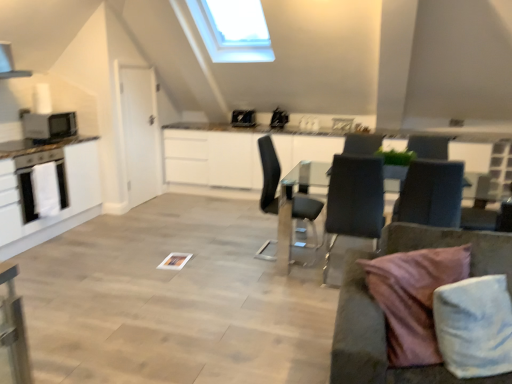
Measure the distance between white glossy cabinetry at left and camera.

white glossy cabinetry at left is 3.52 meters from camera.

Describe the element at coordinates (56, 194) in the screenshot. I see `white glossy cabinetry at left` at that location.

From the picture: What is the approximate height of pink fabric pillow at lower right?

pink fabric pillow at lower right is 18.62 inches in height.

What are the coordinates of `white glossy exhaust hood at upper left` in the screenshot? It's located at (9, 63).

The image size is (512, 384). Find the location of `velvet grey couch at lower right`. velvet grey couch at lower right is located at coordinates (384, 315).

Locate an element on the screen. The height and width of the screenshot is (384, 512). white glossy cabinetry at left is located at coordinates (56, 194).

Between glossy white counter at center and black leather chair at center, the 2th chair when ordered from left to right, which one has larger size?

With larger size is glossy white counter at center.

Which of these two, glossy white counter at center or black leather chair at center, placed as the 2th chair when sorted from right to left, is thinner?

black leather chair at center, placed as the 2th chair when sorted from right to left.

From the image's perspective, count 3rd chairs downward from the glossy white counter at center and point to it. Please provide its 2D coordinates.

[(354, 201)]

Considering the relative sizes of satin black toaster at upper center, the first appliance viewed from the back, and transparent glass table at center in the image provided, is satin black toaster at upper center, the first appliance viewed from the back, bigger than transparent glass table at center?

Actually, satin black toaster at upper center, the first appliance viewed from the back, might be smaller than transparent glass table at center.

Considering the points (253, 125) and (286, 184), which point is in front, point (253, 125) or point (286, 184)?

The point (286, 184) is closer to the camera.

Considering the relative sizes of satin black toaster at upper center, which appears as the third appliance when viewed from the front, and transparent glass table at center in the image provided, is satin black toaster at upper center, which appears as the third appliance when viewed from the front, wider than transparent glass table at center?

No.

From their relative heights in the image, would you say dark gray fabric chair at center, the 3th chair positioned from the left, is taller or shorter than white glossy cabinetry at left?

In the image, dark gray fabric chair at center, the 3th chair positioned from the left, appears to be shorter than white glossy cabinetry at left.

How many degrees apart are the facing directions of dark gray fabric chair at center, the 3th chair positioned from the left, and white glossy cabinetry at left?

There is a 88.7-degree angle between the facing directions of dark gray fabric chair at center, the 3th chair positioned from the left, and white glossy cabinetry at left.

Does dark gray fabric chair at center, the 1th chair in the right-to-left sequence, have a greater width compared to white glossy cabinetry at left?

No.

From the image's perspective, which is above, dark gray fabric chair at center, the 3th chair positioned from the left, or white glossy cabinetry at left?

white glossy cabinetry at left is shown above in the image.

From the image's perspective, is matte black microwave at left, the 3th appliance when ordered from right to left, beneath black leather chair at center, placed as the 2th chair when sorted from right to left?

No.

Considering the sizes of objects matte black microwave at left, the 3th appliance when ordered from right to left, and black leather chair at center, placed as the 2th chair when sorted from right to left, in the image provided, who is shorter, matte black microwave at left, the 3th appliance when ordered from right to left, or black leather chair at center, placed as the 2th chair when sorted from right to left,?

matte black microwave at left, the 3th appliance when ordered from right to left.

Considering the sizes of matte black microwave at left, the first appliance from the front, and black leather chair at center, placed as the 2th chair when sorted from right to left, in the image, is matte black microwave at left, the first appliance from the front, wider or thinner than black leather chair at center, placed as the 2th chair when sorted from right to left,?

Clearly, matte black microwave at left, the first appliance from the front, has less width compared to black leather chair at center, placed as the 2th chair when sorted from right to left.

From a real-world perspective, is matte black microwave at left, the first appliance from the front, positioned above or below black leather chair at center, placed as the 2th chair when sorted from right to left?

Result: matte black microwave at left, the first appliance from the front, is above black leather chair at center, placed as the 2th chair when sorted from right to left.

Consider the image. Between glossy white counter at center and satin black toaster at upper center, the first appliance viewed from the back, which one appears on the left side from the viewer's perspective?

satin black toaster at upper center, the first appliance viewed from the back.

Is glossy white counter at center bigger than satin black toaster at upper center, placed as the 2th appliance when sorted from left to right?

Indeed, glossy white counter at center has a larger size compared to satin black toaster at upper center, placed as the 2th appliance when sorted from left to right.

Does glossy white counter at center turn towards satin black toaster at upper center, the first appliance viewed from the back?

No, glossy white counter at center is not facing towards satin black toaster at upper center, the first appliance viewed from the back.

Is satin black laptop at upper center, which is the first appliance in right-to-left order, in front of transparent glass table at center?

No, the depth of satin black laptop at upper center, which is the first appliance in right-to-left order, is greater than that of transparent glass table at center.

Considering the positions of objects satin black laptop at upper center, which ranks as the second appliance in back-to-front order, and transparent glass table at center in the image provided, who is more to the right, satin black laptop at upper center, which ranks as the second appliance in back-to-front order, or transparent glass table at center?

Positioned to the right is transparent glass table at center.

Does satin black laptop at upper center, which appears as the 2th appliance when viewed from the front, have a smaller size compared to transparent glass table at center?

Correct, satin black laptop at upper center, which appears as the 2th appliance when viewed from the front, occupies less space than transparent glass table at center.

Who is bigger, matte black microwave at left, the 3th appliance when ordered from right to left, or glossy white counter at center?

glossy white counter at center is bigger.

Between matte black microwave at left, positioned as the 1th appliance in left-to-right order, and glossy white counter at center, which one has less height?

With less height is matte black microwave at left, positioned as the 1th appliance in left-to-right order.

From the image's perspective, is matte black microwave at left, positioned as the 1th appliance in left-to-right order, on top of glossy white counter at center?

Yes, from the image's perspective, matte black microwave at left, positioned as the 1th appliance in left-to-right order, is over glossy white counter at center.

Does point (31, 129) come in front of point (332, 156)?

Yes, it is.

Identify the location of the 2nd chair in front of the glossy white counter at center. The image size is (512, 384). (354, 201).

Starting from the transparent glass table at center, which appliance is the 3rd one behind? Please provide its 2D coordinates.

[(243, 118)]

When comparing their distances from satin black laptop at upper center, which is the first appliance in right-to-left order, does pink fabric pillow at lower right or dark gray fabric chair at center, the 1th chair in the right-to-left sequence, seem closer?

dark gray fabric chair at center, the 1th chair in the right-to-left sequence, lies closer to satin black laptop at upper center, which is the first appliance in right-to-left order, than the other object.

Which object lies further to the anchor point white glossy exhaust hood at upper left, white glossy oven at left or dark gray fabric chair at center, the 3th chair positioned from the left?

dark gray fabric chair at center, the 3th chair positioned from the left, is positioned further to the anchor white glossy exhaust hood at upper left.

Looking at this image, considering their positions, is satin black toaster at upper center, which appears as the third appliance when viewed from the front, positioned closer to transparent glass table at center than white glossy oven at left?

satin black toaster at upper center, which appears as the third appliance when viewed from the front, is closer to transparent glass table at center.

Estimate the real-world distances between objects in this image. Which object is further from satin black toaster at upper center, which appears as the third appliance when viewed from the front, dark gray fabric chair at center, the 1th chair in the right-to-left sequence, or white glossy exhaust hood at upper left?

dark gray fabric chair at center, the 1th chair in the right-to-left sequence, is positioned further to the anchor satin black toaster at upper center, which appears as the third appliance when viewed from the front.

Looking at the image, which one is located closer to satin black toaster at upper center, placed as the 2th appliance when sorted from left to right, pink fabric pillow at lower right or white glossy exhaust hood at upper left?

white glossy exhaust hood at upper left lies closer to satin black toaster at upper center, placed as the 2th appliance when sorted from left to right, than the other object.

When comparing their distances from white glossy sink at upper center, does white glossy cabinetry at left or velvet grey couch at lower right seem closer?

Based on the image, white glossy cabinetry at left appears to be nearer to white glossy sink at upper center.

Considering their positions, is white glossy oven at left positioned closer to transparent glass table at center than white glossy sink at upper center?

Based on the image, white glossy sink at upper center appears to be nearer to transparent glass table at center.

Estimate the real-world distances between objects in this image. Which object is further from matte black microwave at left, the 3th appliance when ordered from right to left, black leather chair at center, which is the 3th chair in right-to-left order, or white glossy sink at upper center?

Based on the image, white glossy sink at upper center appears to be further to matte black microwave at left, the 3th appliance when ordered from right to left.

Identify the location of counter located between pink fabric pillow at lower right and white glossy sink at upper center in the depth direction. The height and width of the screenshot is (384, 512). (213, 155).

Locate an element on the screen. studio couch located between white glossy cabinetry at left and black leather chair at center, the 2th chair when ordered from left to right, in the left-right direction is located at coordinates (384, 315).

This screenshot has height=384, width=512. I want to click on chair located between white glossy oven at left and black leather chair at center, the 2th chair when ordered from left to right, in the left-right direction, so click(269, 175).

Identify the location of chair positioned between black leather chair at center, the 2th chair when ordered from left to right, and satin black toaster at upper center, placed as the 2th appliance when sorted from right to left, from near to far. (269, 175).